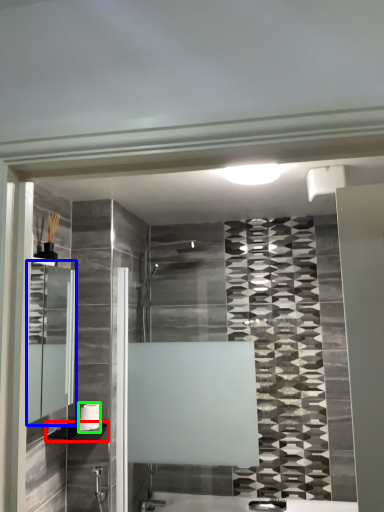
Question: Based on their relative distances, which object is nearer to shelf (highlighted by a red box)? Choose from medicine cabinet (highlighted by a blue box) and towel bar (highlighted by a green box).

Choices:
 (A) medicine cabinet
 (B) towel bar

Answer: (B)